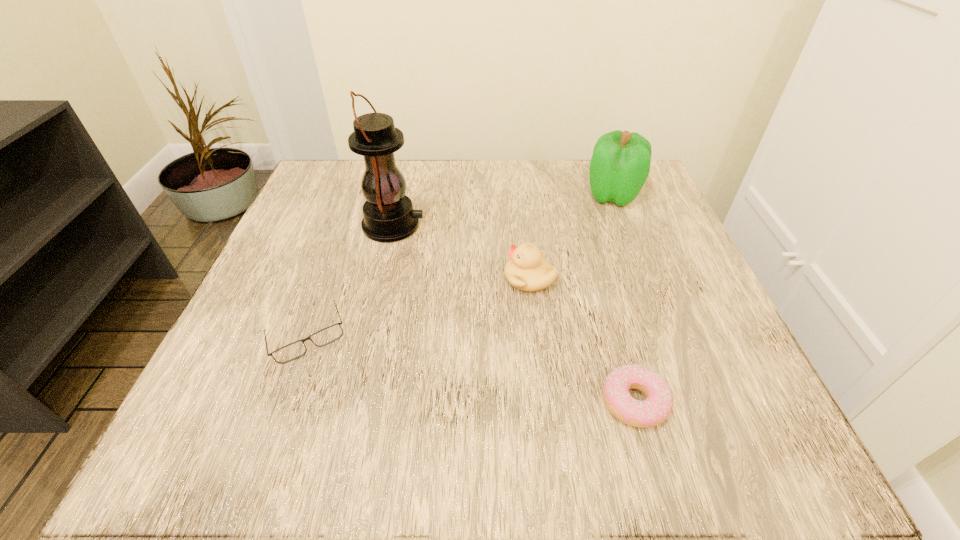
Image resolution: width=960 pixels, height=540 pixels. I want to click on object present at the far left corner, so click(x=388, y=216).

What are the coordinates of `object present at the far right corner` in the screenshot? It's located at (620, 164).

Find the location of a particular element. Image resolution: width=960 pixels, height=540 pixels. object that is at the near right corner is located at coordinates (657, 406).

Locate an element on the screen. The width and height of the screenshot is (960, 540). vacant space at the far edge is located at coordinates click(x=410, y=181).

This screenshot has width=960, height=540. In the image, there is a desktop. Find the location of `vacant space at the near edge`. vacant space at the near edge is located at coordinates (398, 422).

In the image, there is a desktop. Identify the location of vacant space at the left edge. (304, 318).

Where is `vacant space at the right edge`? vacant space at the right edge is located at coordinates (652, 305).

Where is `vacant space at the far left corner`? The image size is (960, 540). vacant space at the far left corner is located at coordinates (323, 179).

Identify the location of free location at the near right corner. (668, 435).

The width and height of the screenshot is (960, 540). I want to click on free space between the doughnut and the fourth farthest object, so click(x=470, y=369).